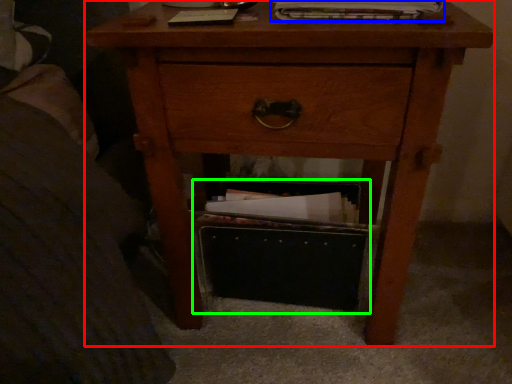
Question: Which is nearer to the nightstand (highlighted by a red box)? magazine (highlighted by a blue box) or shoe box (highlighted by a green box).

Choices:
 (A) magazine
 (B) shoe box

Answer: (B)